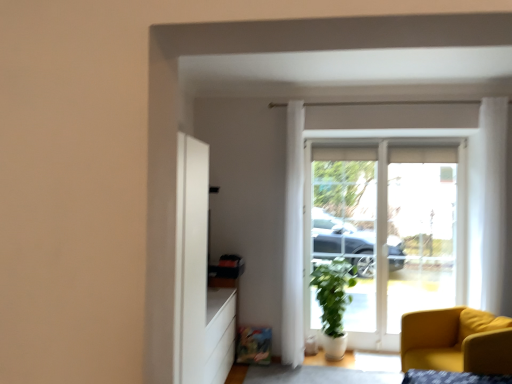
Question: Is white sheer curtain at center, the first curtain from the back, not within green matte plant at center?

Choices:
 (A) no
 (B) yes

Answer: (B)

Question: Is white sheer curtain at center, arranged as the second curtain when viewed from the front, to the right of green matte plant at center from the viewer's perspective?

Choices:
 (A) yes
 (B) no

Answer: (B)

Question: Does white sheer curtain at center, the first curtain from the back, have a greater width compared to green matte plant at center?

Choices:
 (A) no
 (B) yes

Answer: (A)

Question: From the image's perspective, would you say white sheer curtain at center, arranged as the first curtain when viewed from the left, is shown under green matte plant at center?

Choices:
 (A) no
 (B) yes

Answer: (A)

Question: Are white sheer curtain at center, arranged as the second curtain when viewed from the front, and green matte plant at center beside each other?

Choices:
 (A) yes
 (B) no

Answer: (B)

Question: Is green matte plant at center at the back of white sheer curtain at center, arranged as the first curtain when viewed from the left?

Choices:
 (A) no
 (B) yes

Answer: (A)

Question: Is white sheer curtain at center, arranged as the second curtain when viewed from the front, oriented towards matte yellow armchair at lower right?

Choices:
 (A) yes
 (B) no

Answer: (B)

Question: Is white sheer curtain at center, arranged as the first curtain when viewed from the left, not within matte yellow armchair at lower right?

Choices:
 (A) yes
 (B) no

Answer: (A)

Question: Is white sheer curtain at center, the first curtain from the back, further to camera compared to matte yellow armchair at lower right?

Choices:
 (A) no
 (B) yes

Answer: (B)

Question: Is white sheer curtain at center, which appears as the second curtain when viewed from the right, placed right next to matte yellow armchair at lower right?

Choices:
 (A) yes
 (B) no

Answer: (B)

Question: From the image's perspective, is white sheer curtain at center, the first curtain from the back, on top of matte yellow armchair at lower right?

Choices:
 (A) no
 (B) yes

Answer: (B)

Question: Is matte yellow armchair at lower right surrounded by white sheer curtain at center, which appears as the second curtain when viewed from the right?

Choices:
 (A) yes
 (B) no

Answer: (B)

Question: Does white glass door at center lie in front of white sheer curtain at upper right, which is the first curtain in front-to-back order?

Choices:
 (A) yes
 (B) no

Answer: (B)